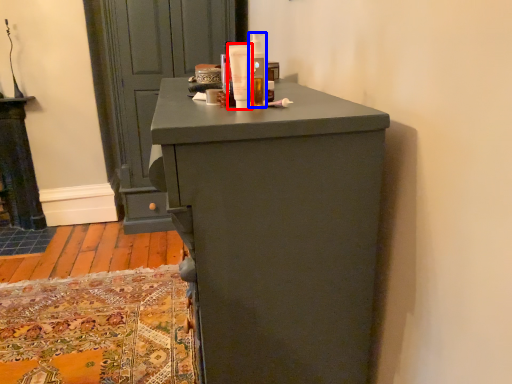
Question: Among these objects, which one is nearest to the camera, toiletry (highlighted by a red box) or toiletry (highlighted by a blue box)?

Choices:
 (A) toiletry
 (B) toiletry

Answer: (A)